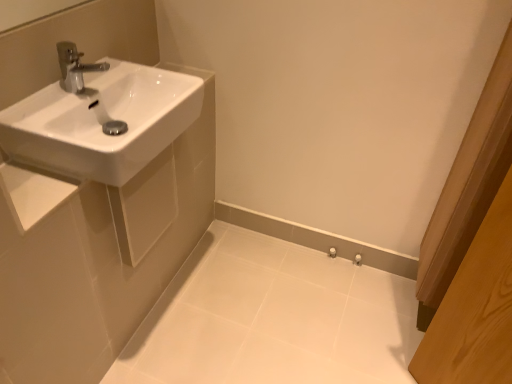
Question: Considering the relative sizes of white glossy sink at left and white glossy porcelain at lower center in the image provided, is white glossy sink at left bigger than white glossy porcelain at lower center?

Choices:
 (A) yes
 (B) no

Answer: (B)

Question: Is white glossy sink at left facing away from white glossy porcelain at lower center?

Choices:
 (A) no
 (B) yes

Answer: (A)

Question: Could you tell me if white glossy sink at left is facing white glossy porcelain at lower center?

Choices:
 (A) yes
 (B) no

Answer: (B)

Question: Considering the relative positions of white glossy sink at left and white glossy porcelain at lower center in the image provided, is white glossy sink at left behind white glossy porcelain at lower center?

Choices:
 (A) yes
 (B) no

Answer: (B)

Question: Does white glossy sink at left have a greater width compared to white glossy porcelain at lower center?

Choices:
 (A) yes
 (B) no

Answer: (B)

Question: Is white glossy sink at left wider or thinner than white glossy porcelain at lower center?

Choices:
 (A) wide
 (B) thin

Answer: (B)

Question: Considering their positions, is white glossy sink at left located in front of or behind white glossy porcelain at lower center?

Choices:
 (A) front
 (B) behind

Answer: (A)

Question: Do you think white glossy sink at left is within white glossy porcelain at lower center, or outside of it?

Choices:
 (A) outside
 (B) inside

Answer: (A)

Question: Considering the positions of point (135, 240) and point (244, 331), is point (135, 240) closer or farther from the camera than point (244, 331)?

Choices:
 (A) farther
 (B) closer

Answer: (B)

Question: Considering the positions of point (135, 82) and point (117, 192), is point (135, 82) closer or farther from the camera than point (117, 192)?

Choices:
 (A) farther
 (B) closer

Answer: (A)

Question: From a real-world perspective, relative to white glossy sink at left, is white glossy sink at upper left vertically above or below?

Choices:
 (A) below
 (B) above

Answer: (B)

Question: Based on their sizes in the image, would you say white glossy sink at upper left is bigger or smaller than white glossy sink at left?

Choices:
 (A) big
 (B) small

Answer: (A)

Question: Considering the relative positions of white glossy sink at upper left and white glossy sink at left in the image provided, is white glossy sink at upper left to the left or to the right of white glossy sink at left?

Choices:
 (A) right
 (B) left

Answer: (B)

Question: Relative to white glossy porcelain at lower center, is white glossy sink at upper left in front or behind?

Choices:
 (A) behind
 (B) front

Answer: (B)

Question: Looking at their shapes, would you say white glossy sink at upper left is wider or thinner than white glossy porcelain at lower center?

Choices:
 (A) thin
 (B) wide

Answer: (A)